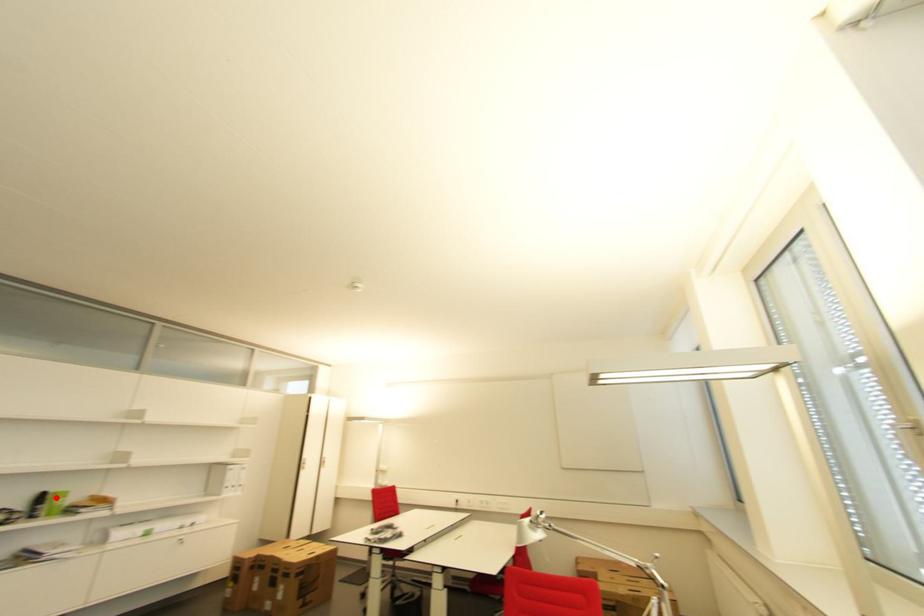
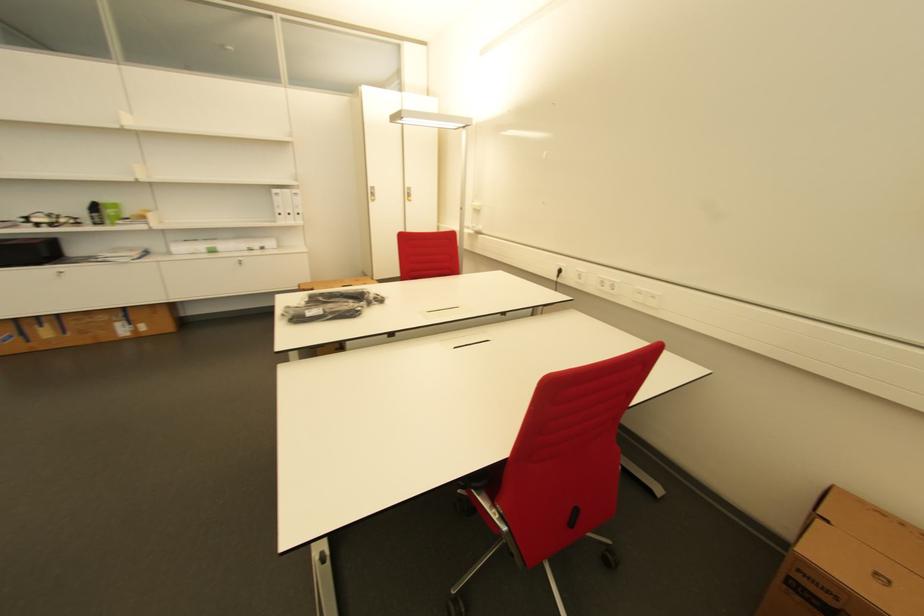
Question: I am providing you with two images of the same scene from different viewpoints. Given a red point in image1, look at the same physical point in image2. Is it:

Choices:
 (A) Closer to the viewpoint
 (B) Farther from the viewpoint

Answer: (B)